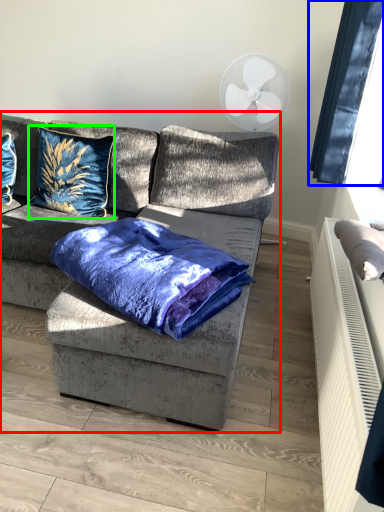
Question: Considering the real-world distances, which object is farthest from studio couch (highlighted by a red box)? window screen (highlighted by a blue box) or pillow (highlighted by a green box)?

Choices:
 (A) window screen
 (B) pillow

Answer: (A)